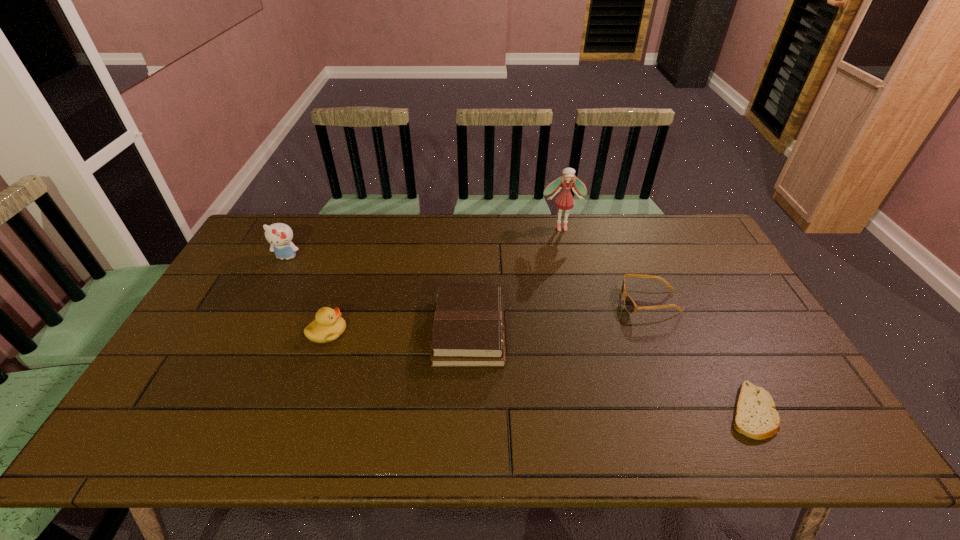
Locate an element on the screen. kitten situated at the far edge is located at coordinates (279, 235).

Find the location of a particular element. The width and height of the screenshot is (960, 540). object positioned at the near edge is located at coordinates (755, 416).

Locate an element on the screen. The height and width of the screenshot is (540, 960). object that is at the left edge is located at coordinates (279, 235).

Where is `object present at the right edge`? This screenshot has width=960, height=540. object present at the right edge is located at coordinates (755, 416).

In order to click on object located in the far left corner section of the desktop in this screenshot , I will do `click(279, 235)`.

Locate an element on the screen. The image size is (960, 540). object that is positioned at the near right corner is located at coordinates (755, 416).

Where is `blank space at the far edge of the desktop`? The width and height of the screenshot is (960, 540). blank space at the far edge of the desktop is located at coordinates (308, 219).

Locate an element on the screen. Image resolution: width=960 pixels, height=540 pixels. free space at the near edge is located at coordinates (220, 426).

At what (x,y) coordinates should I click in order to perform the action: click on vacant area at the left edge. Please return your answer as a coordinate pair (x, y). Looking at the image, I should click on (209, 350).

In order to click on free region at the right edge of the desktop in this screenshot , I will do `click(711, 308)`.